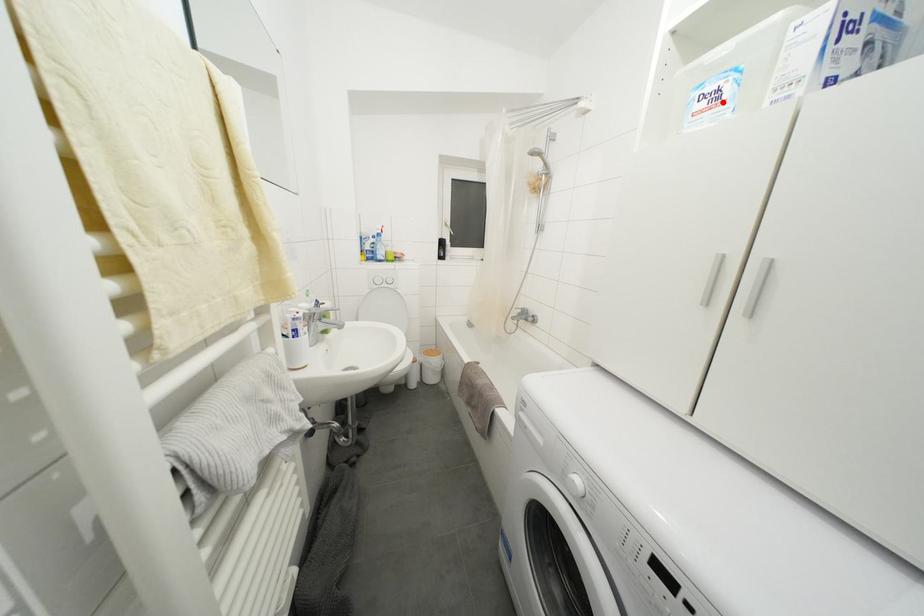
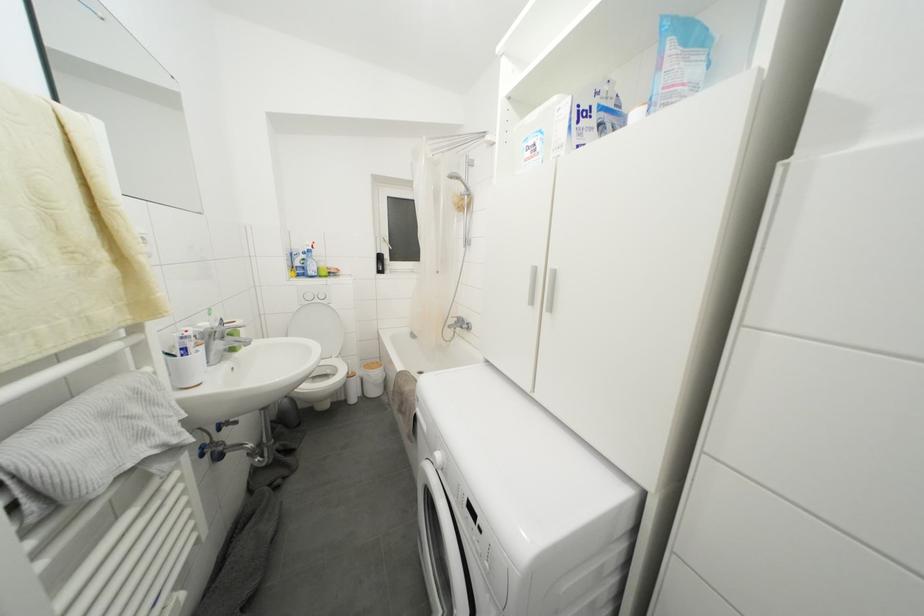
The point at the highlighted location is marked in the first image. Where is the corresponding point in the second image?

(540, 155)